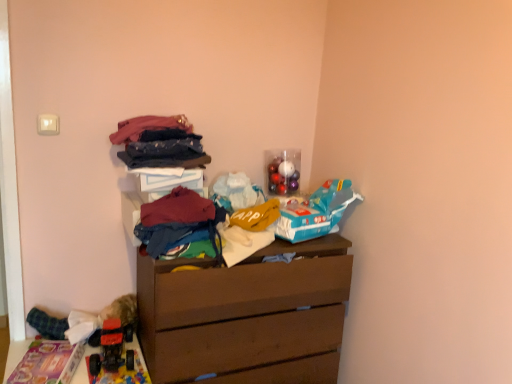
This screenshot has height=384, width=512. Find the location of `free space above plastic toy car at lower left (from a real-world perspective)`. free space above plastic toy car at lower left (from a real-world perspective) is located at coordinates (73, 362).